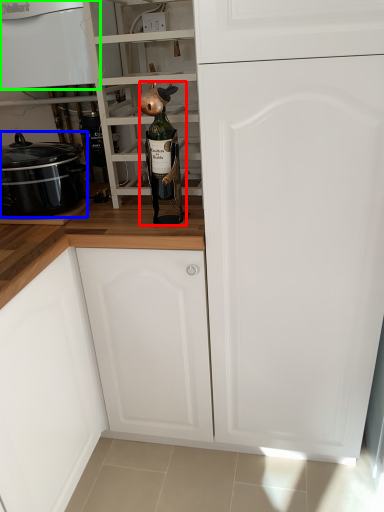
Question: Based on their relative distances, which object is farther from beer bottle (highlighted by a red box)? Choose from kitchen appliance (highlighted by a blue box) and home appliance (highlighted by a green box).

Choices:
 (A) kitchen appliance
 (B) home appliance

Answer: (B)